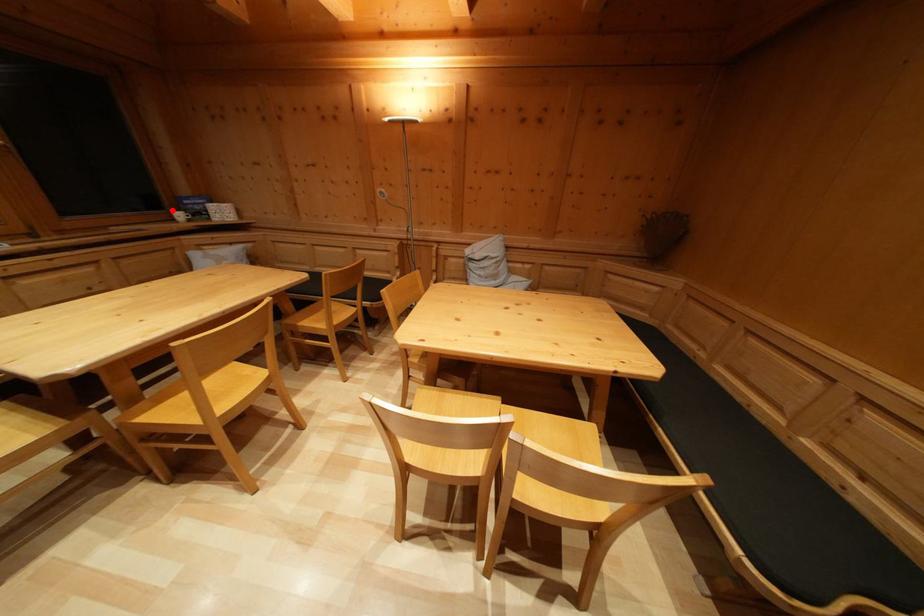
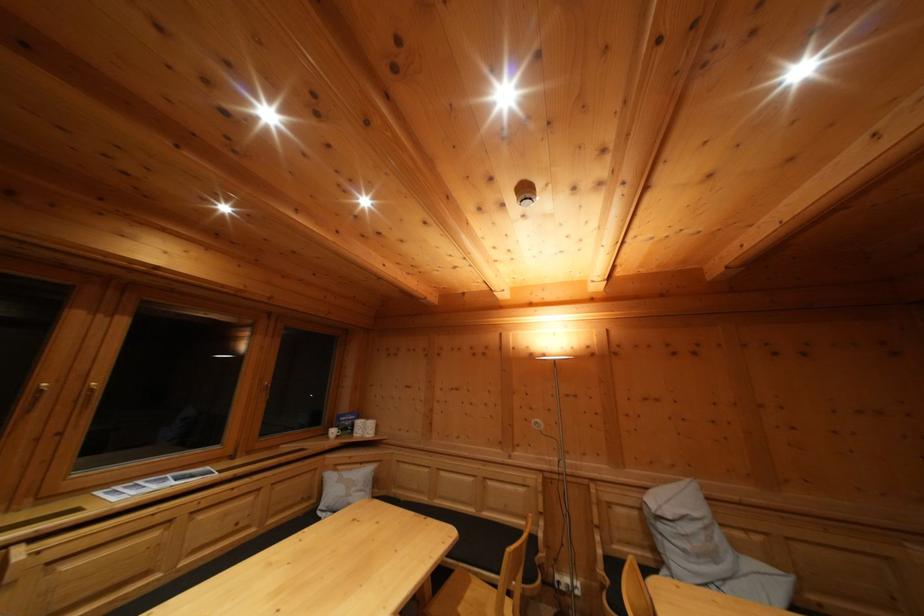
In the second image, find the point that corresponds to the highlighted location in the first image.

(332, 426)